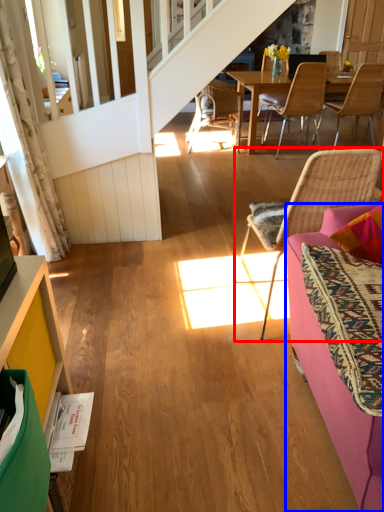
Question: Which of the following is the farthest to the observer, chair (highlighted by a red box) or studio couch (highlighted by a blue box)?

Choices:
 (A) chair
 (B) studio couch

Answer: (A)